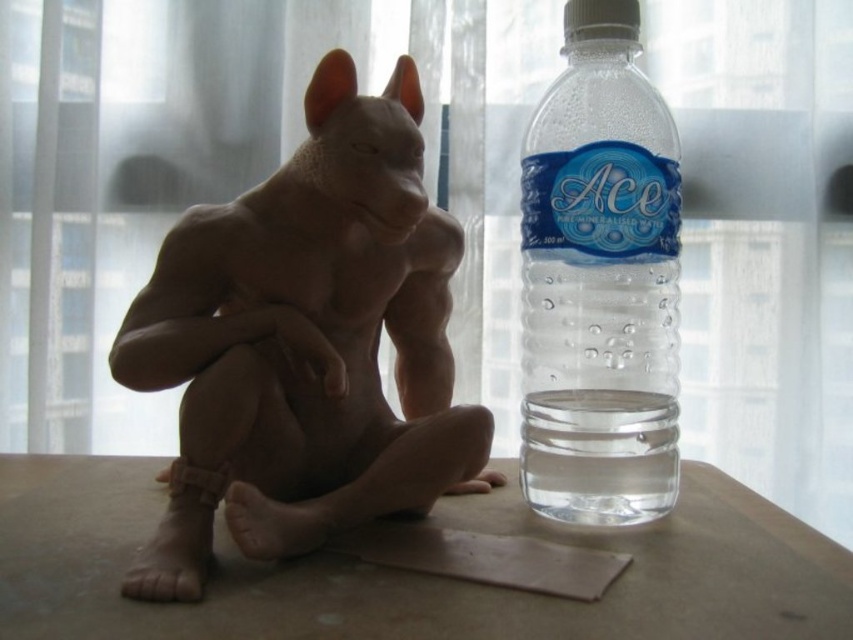
Question: Does matte brown table at lower center lie behind clear plastic bottle at right?

Choices:
 (A) yes
 (B) no

Answer: (B)

Question: Is matte brown table at lower center bigger than clear plastic bottle at right?

Choices:
 (A) yes
 (B) no

Answer: (A)

Question: Among these points, which one is nearest to the camera?

Choices:
 (A) (444, 467)
 (B) (627, 589)
 (C) (537, 429)

Answer: (B)

Question: Does matte brown statue at center appear on the left side of matte brown table at lower center?

Choices:
 (A) yes
 (B) no

Answer: (B)

Question: Which object appears farthest from the camera in this image?

Choices:
 (A) matte brown table at lower center
 (B) clear plastic bottle at right

Answer: (B)

Question: Considering the real-world distances, which object is closest to the matte brown statue at center?

Choices:
 (A) matte brown table at lower center
 (B) clear plastic bottle at right

Answer: (A)